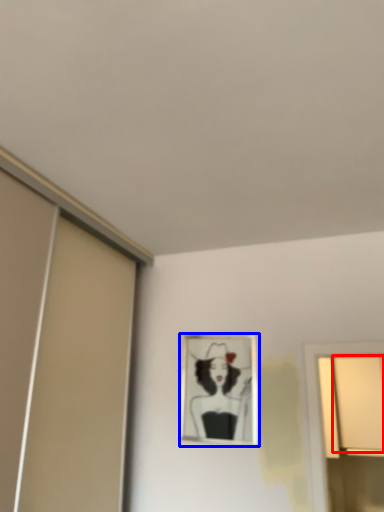
Question: Among these objects, which one is nearest to the camera, window (highlighted by a red box) or picture frame (highlighted by a blue box)?

Choices:
 (A) window
 (B) picture frame

Answer: (B)